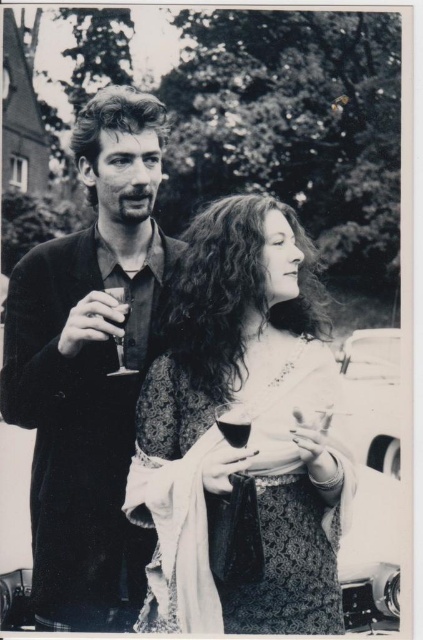
Based on the scene described, what object is located at the coordinates point (x=249, y=433)?

The patterned fabric dress at center is located at point (x=249, y=433).